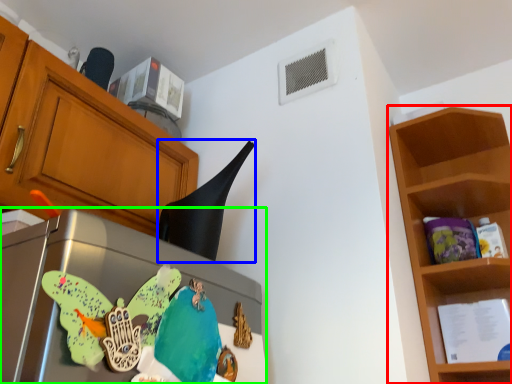
Question: Which object is positioned farthest from shelf (highlighted by a red box)? Select from exhaust hood (highlighted by a blue box) and appliance (highlighted by a green box).

Choices:
 (A) exhaust hood
 (B) appliance

Answer: (B)